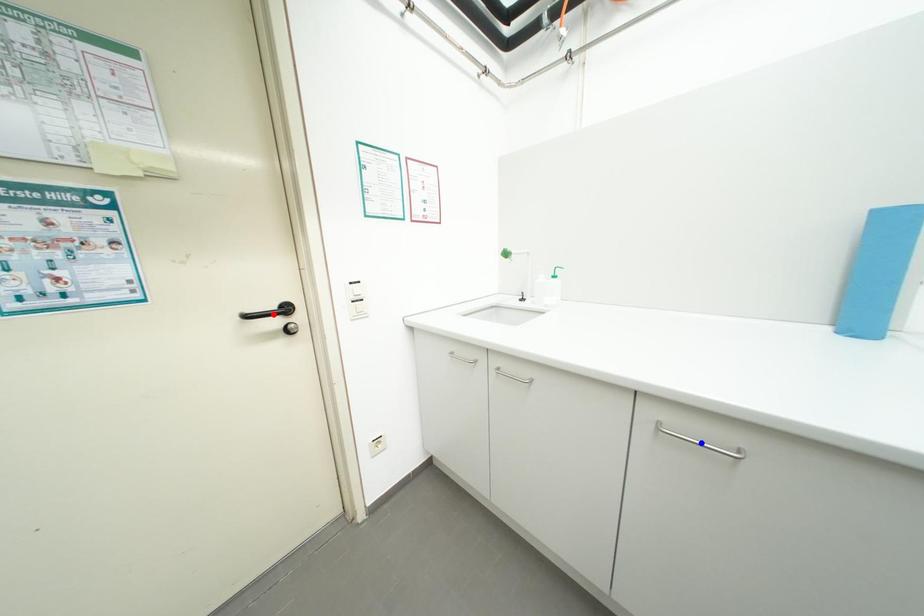
Question: Two points are marked on the image. Which point is closer to the camera?

Choices:
 (A) Blue point is closer.
 (B) Red point is closer.

Answer: (A)